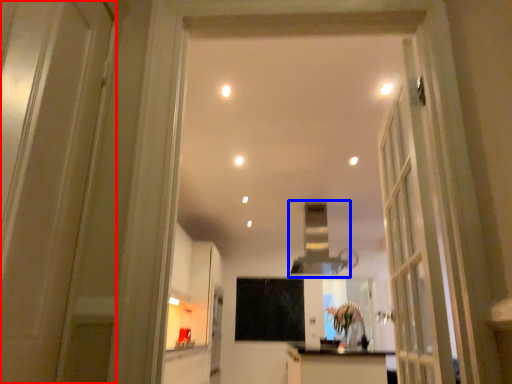
Question: Which object is closer to the camera taking this photo, door (highlighted by a red box) or exhaust hood (highlighted by a blue box)?

Choices:
 (A) door
 (B) exhaust hood

Answer: (A)